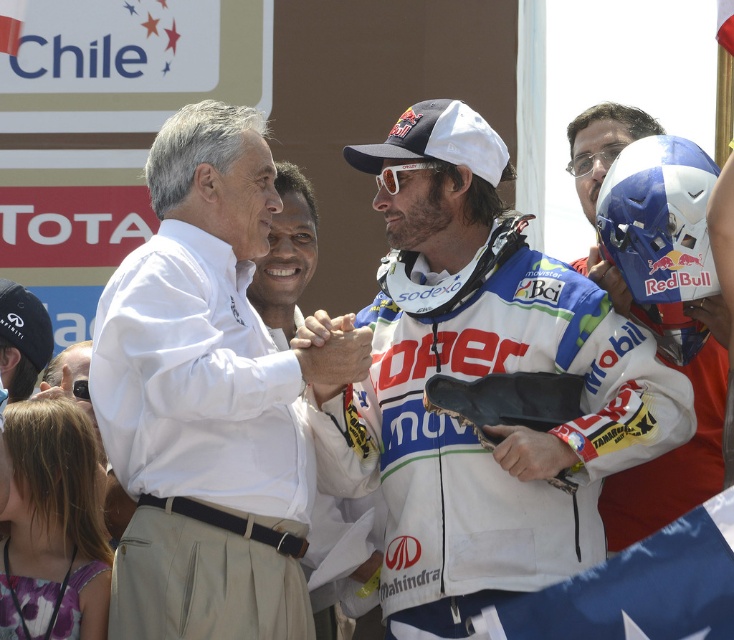
You are a photographer at the event and need to capture a photo where both the white cotton shirt at center and the blue matte helmet at right are clearly visible. Given their sizes, which object should you focus on to ensure both are in frame without cropping?

The white cotton shirt at center is larger than the blue matte helmet at right, so focusing on the white cotton shirt at center will ensure both objects are in frame without cropping.

You are a photographer positioned at the edge of the rally course. You want to take a photo that includes both the white matte jacket at center and the white matte goggles at center. Given that your camera has a maximum focus range of 7 meters, will you be able to capture both objects in focus simultaneously?

The white matte jacket at center and white matte goggles at center are 7.53 meters apart. Since the distance between them exceeds the camera lens focus range of 7 meters, you won

In the scene shown: You are a photographer at the event and need to capture a photo where both the white cotton shirt at center and the blue matte helmet at right are clearly visible. Based on their positions, which object should you focus on first to ensure both are in frame?

The white cotton shirt at center is located below the blue matte helmet at right, so focusing on the blue matte helmet at right first will ensure both are within the frame since the shirt is positioned lower.